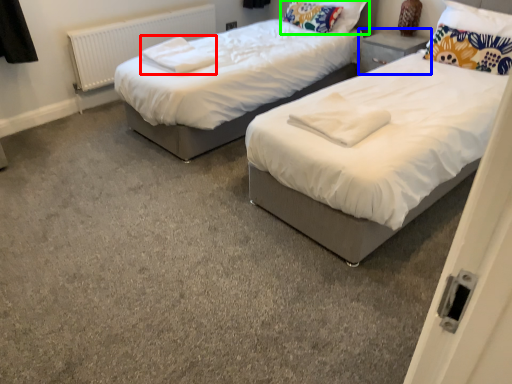
Question: Based on their relative distances, which object is farther from linen (highlighted by a red box)? Choose from nightstand (highlighted by a blue box) and pillow (highlighted by a green box).

Choices:
 (A) nightstand
 (B) pillow

Answer: (A)